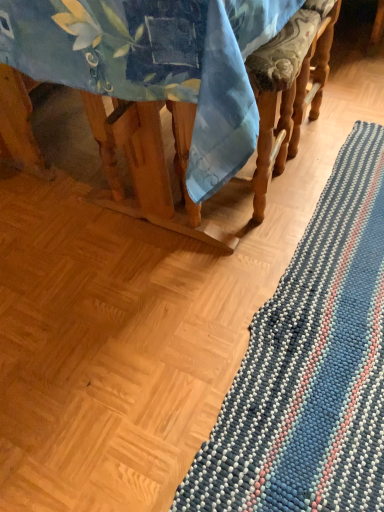
Question: Is blue fabric tablecloth at upper left a part of blue striped rug at lower right?

Choices:
 (A) no
 (B) yes

Answer: (A)

Question: Is blue striped rug at lower right far from blue fabric tablecloth at upper left?

Choices:
 (A) no
 (B) yes

Answer: (A)

Question: Is blue striped rug at lower right wider than blue fabric tablecloth at upper left?

Choices:
 (A) yes
 (B) no

Answer: (B)

Question: Is blue striped rug at lower right not within blue fabric tablecloth at upper left?

Choices:
 (A) yes
 (B) no

Answer: (A)

Question: Is blue striped rug at lower right thinner than blue fabric tablecloth at upper left?

Choices:
 (A) yes
 (B) no

Answer: (A)

Question: Does blue striped rug at lower right lie in front of blue fabric tablecloth at upper left?

Choices:
 (A) no
 (B) yes

Answer: (A)

Question: Is the depth of blue fabric tablecloth at upper left less than that of blue striped rug at lower right?

Choices:
 (A) no
 (B) yes

Answer: (B)

Question: Is blue fabric tablecloth at upper left at the left side of blue striped rug at lower right?

Choices:
 (A) no
 (B) yes

Answer: (B)

Question: Considering the relative sizes of blue fabric tablecloth at upper left and blue striped rug at lower right in the image provided, is blue fabric tablecloth at upper left shorter than blue striped rug at lower right?

Choices:
 (A) no
 (B) yes

Answer: (A)

Question: Does blue fabric tablecloth at upper left turn towards blue striped rug at lower right?

Choices:
 (A) yes
 (B) no

Answer: (A)

Question: Is blue fabric tablecloth at upper left thinner than blue striped rug at lower right?

Choices:
 (A) no
 (B) yes

Answer: (A)

Question: Are blue fabric tablecloth at upper left and blue striped rug at lower right located far from each other?

Choices:
 (A) yes
 (B) no

Answer: (B)

Question: Is blue fabric tablecloth at upper left situated inside blue striped rug at lower right or outside?

Choices:
 (A) outside
 (B) inside

Answer: (A)